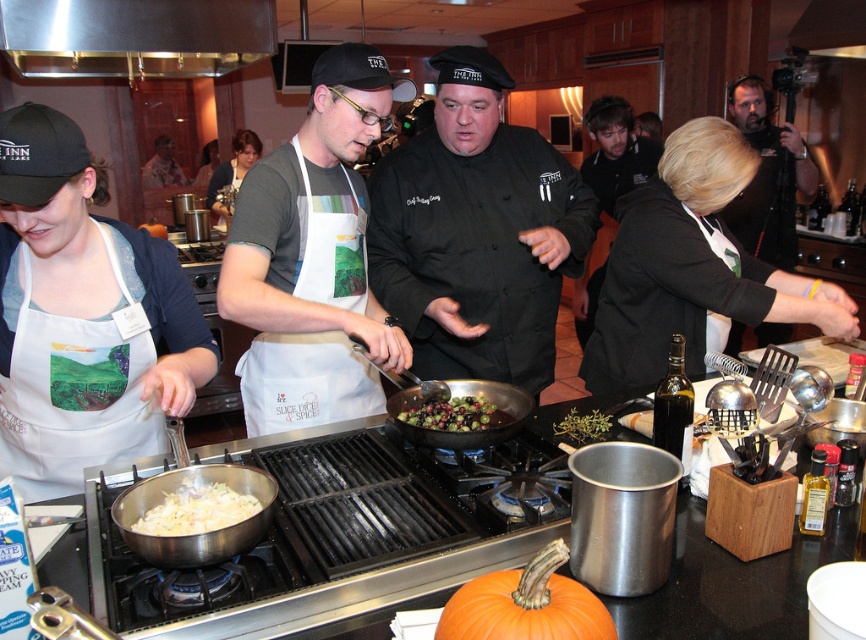
Question: In this image, where is black matte apron at center located relative to black matte camera at upper right?

Choices:
 (A) above
 (B) below

Answer: (B)

Question: Which of these objects is positioned farthest from the shiny black pan at center?

Choices:
 (A) black matte camera at upper right
 (B) black matte chef coat at center

Answer: (A)

Question: Does black matte apron at center appear over shiny black pan at center?

Choices:
 (A) no
 (B) yes

Answer: (B)

Question: Is stainless steel exhaust hood at upper center smaller than green glossy olives at center?

Choices:
 (A) yes
 (B) no

Answer: (B)

Question: Which point is farther to the camera?

Choices:
 (A) (423, 157)
 (B) (768, 120)
 (C) (725, 305)

Answer: (B)

Question: Estimate the real-world distances between objects in this image. Which object is closer to the black matte chef coat at center?

Choices:
 (A) green glossy olives at center
 (B) shiny black pan at center
 (C) black matte camera at upper right

Answer: (B)